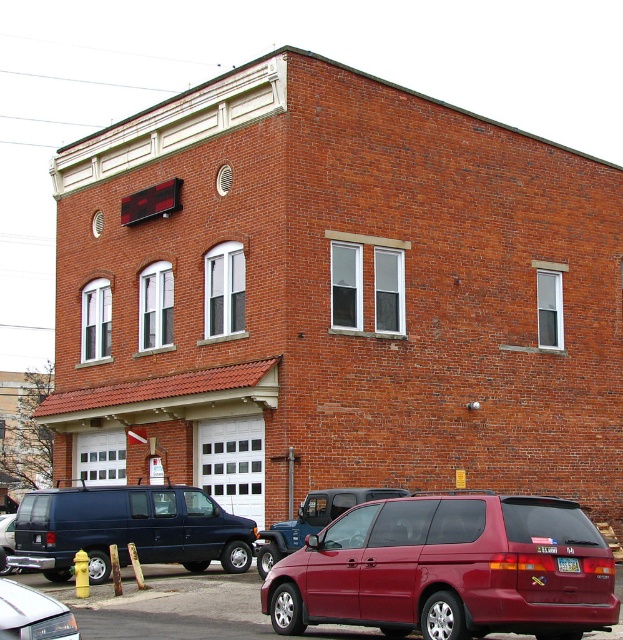
Who is shorter, maroon matte suv at center or white glossy sedan at lower left?

With less height is white glossy sedan at lower left.

Looking at this image, which of these two, maroon matte suv at center or white glossy sedan at lower left, stands taller?

maroon matte suv at center is taller.

This screenshot has height=640, width=623. Describe the element at coordinates (313, 520) in the screenshot. I see `maroon matte suv at center` at that location.

The width and height of the screenshot is (623, 640). In order to click on maroon matte suv at center in this screenshot , I will do `click(313, 520)`.

Does point (540, 515) lie in front of point (100, 524)?

Yes.

You are a GUI agent. You are given a task and a screenshot of the screen. Output one action in this format:
    pyautogui.click(x=<x>, y=<y>)
    Task: Click on the maroon matte minivan at lower right
    
    Given the screenshot: What is the action you would take?
    pyautogui.click(x=449, y=570)

Between matte black van at lower left and white glossy sedan at lower left, which one has more height?

matte black van at lower left

Can you confirm if matte black van at lower left is taller than white glossy sedan at lower left?

Yes, matte black van at lower left is taller than white glossy sedan at lower left.

The image size is (623, 640). What do you see at coordinates (126, 529) in the screenshot?
I see `matte black van at lower left` at bounding box center [126, 529].

At what (x,y) coordinates should I click in order to perform the action: click on matte black van at lower left. Please return your answer as a coordinate pair (x, y). The image size is (623, 640). Looking at the image, I should click on (126, 529).